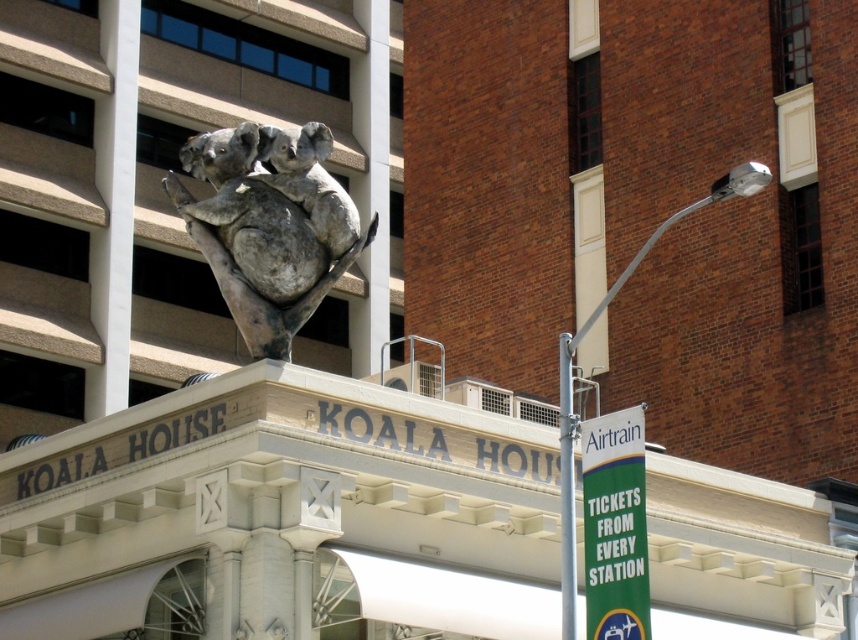
You are an architect analyzing the building facade. Which object, the white smooth pillar at upper left or the metallic silver lamp post at upper right, takes up more space on the building facade?

The metallic silver lamp post at upper right takes up more space on the building facade than the white smooth pillar at upper left because the white smooth pillar at upper left occupies less space than metallic silver lamp post at upper right.

You are standing in front of the KOALA HOUSE building and want to determine the relative positions of two points marked on the building facade. The first point is at coordinates point (644, 577) and the second is at point (565, 435). Which point is nearer to you?

Point (644, 577) is closer to the viewer than point (565, 435).

You are standing in front of the KOALA HOUSE building and want to hang a new sign. The sign is 1.2 meters wide. There is a green fabric banner at right and a metallic pole at center. Which object is closer to you, and can the sign fit between them?

The green fabric banner at right is closer to the viewer than the metallic pole at center. The distance between them is not specified, so we cannot determine if the 1.2 meter wide sign will fit between them.